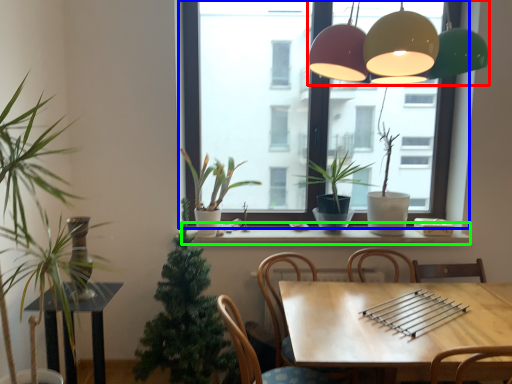
Question: Which is nearer to the lamp (highlighted by a red box)? window (highlighted by a blue box) or window sill (highlighted by a green box).

Choices:
 (A) window
 (B) window sill

Answer: (B)